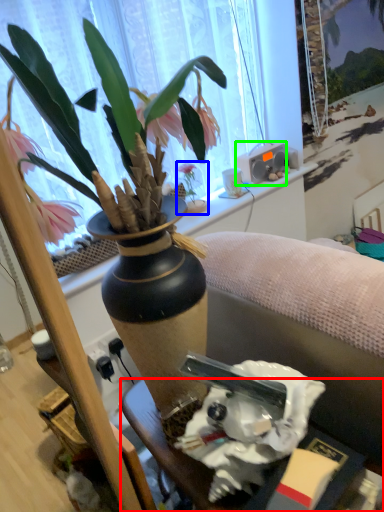
Question: Considering the real-world distances, which object is farthest from desk (highlighted by a red box)? houseplant (highlighted by a blue box) or loudspeaker (highlighted by a green box)?

Choices:
 (A) houseplant
 (B) loudspeaker

Answer: (B)